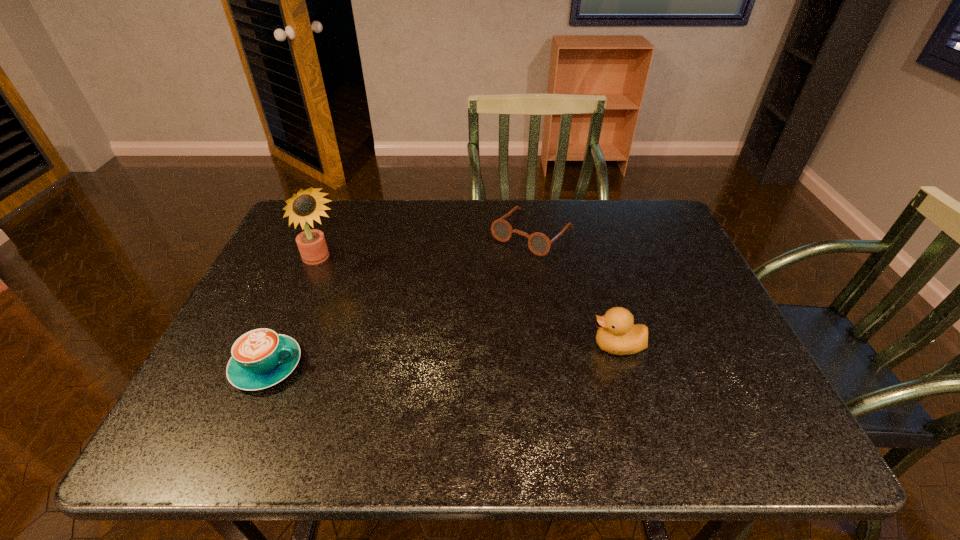
Where is `free spot on the desktop that is between the cappuccino and the duckling and is positioned on the face of the tallest object`? The image size is (960, 540). free spot on the desktop that is between the cappuccino and the duckling and is positioned on the face of the tallest object is located at coordinates (401, 358).

Image resolution: width=960 pixels, height=540 pixels. I want to click on free space on the desktop that is between the cappuccino and the duckling and is positioned on the front-facing side of the spectacles, so click(418, 357).